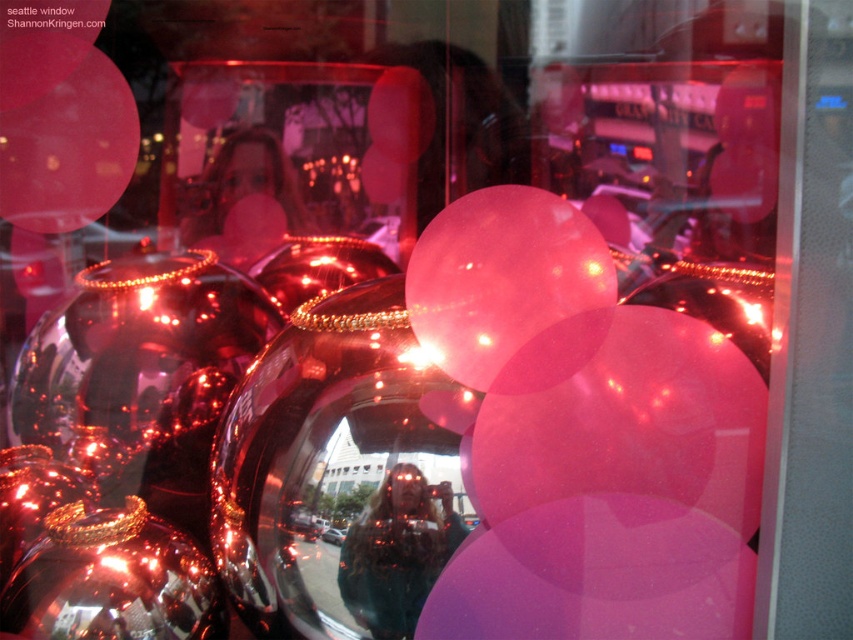
You are a delivery person who needs to place a new pink balloon into the display. The new balloon is 36 inches in diameter. There is a space between the pink translucent balloon at center and the pink matte balloon at upper left. Can the new balloon fit in that space?

The space between the pink translucent balloon at center and the pink matte balloon at upper left is 35.87 inches. Since the new balloon is 36 inches in diameter, it cannot fit in that space as it is slightly larger than the available gap.

You are standing in front of a festive window display with metallic baubles and pink balloons. You spot a point marked at coordinates (502, 276). Which object does this point belong to?

The point at coordinates (502, 276) is on the pink translucent balloon at center.

You are standing in front of a festive window display with metallic baubles and pink balloons. You notice a point marked at coordinates (502, 276). Which object from the scene does this point belong to?

The point at coordinates (502, 276) is on the pink translucent balloon at center.